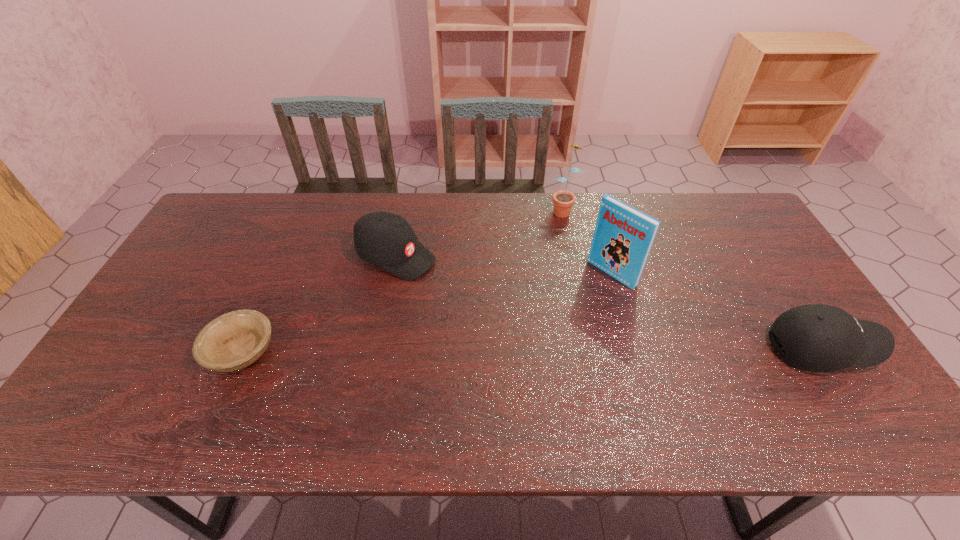
Where is `blank space located 0.170m with a logo on the front of the fourth object from right to left`? This screenshot has width=960, height=540. blank space located 0.170m with a logo on the front of the fourth object from right to left is located at coordinates (476, 291).

Identify the location of free space located 0.200m with a logo on the front of the fourth object from right to left. (486, 295).

Where is `vacant space located on the front cover of the book`? The image size is (960, 540). vacant space located on the front cover of the book is located at coordinates (588, 294).

At what (x,y) coordinates should I click in order to perform the action: click on vacant space located 0.160m on the front cover of the book. Please return your answer as a coordinate pair (x, y). The height and width of the screenshot is (540, 960). Looking at the image, I should click on (564, 314).

Identify the location of blank area located 0.340m on the front cover of the book. (518, 352).

Where is `vacant area located 0.140m on the flower of the farthest object`? This screenshot has width=960, height=540. vacant area located 0.140m on the flower of the farthest object is located at coordinates (547, 244).

Identify the location of free region located 0.170m on the flower of the farthest object. (544, 249).

I want to click on free location located on the flower of the farthest object, so click(x=550, y=238).

The image size is (960, 540). In order to click on baseball cap at the far edge in this screenshot , I will do `click(384, 239)`.

Where is `sunflower situated at the far edge`? The width and height of the screenshot is (960, 540). sunflower situated at the far edge is located at coordinates (563, 200).